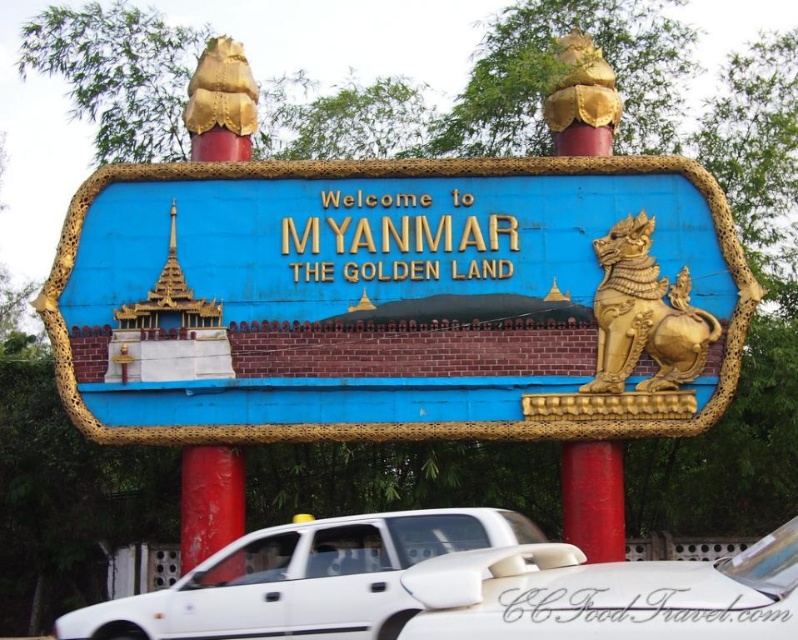
You are standing in front of the welcome sign for Myanmar. There are two points marked on the sign, one at coordinate point [591,477] and another at point [200,532]. If you want to touch both points starting from the closer one to you, which point should you touch first?

You should touch point [591,477] first because it is closer to you than point [200,532].